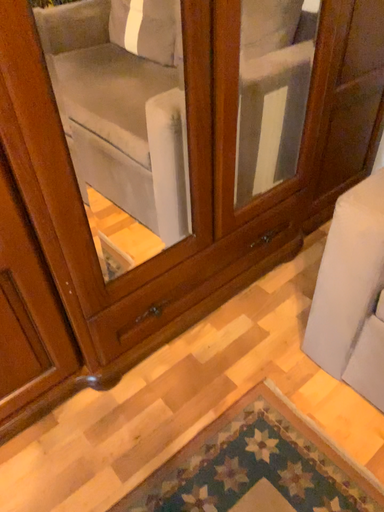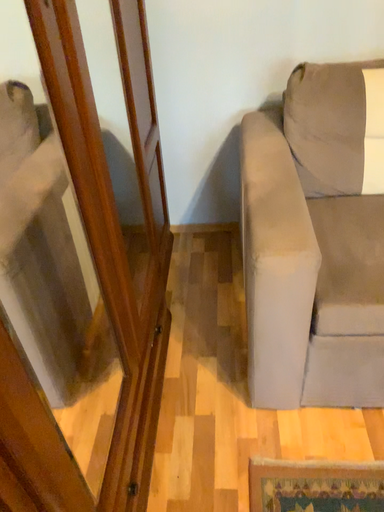
Question: Which way did the camera rotate in the video?

Choices:
 (A) rotated downward
 (B) rotated upward

Answer: (B)